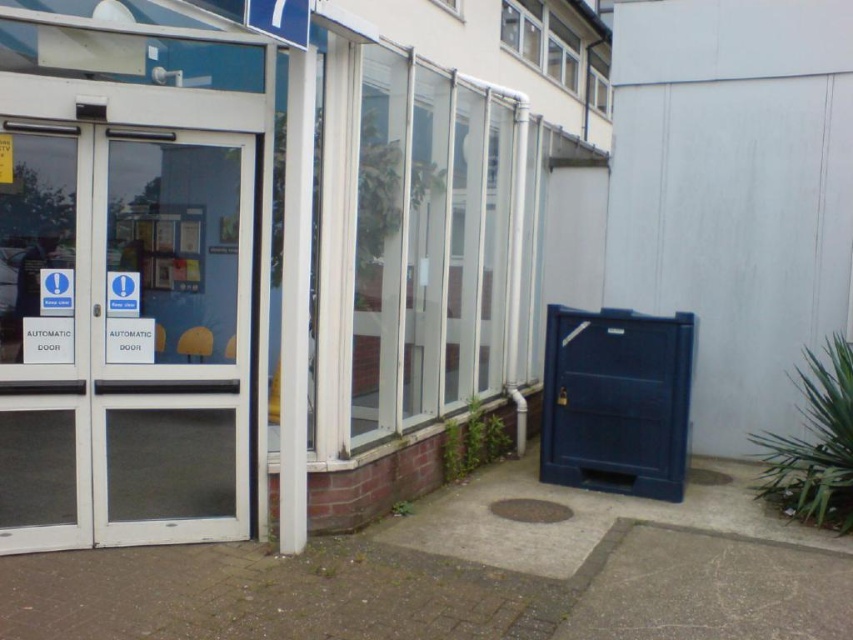
Which of these two, transparent glass door at left or transparent glass door at center, stands taller?

With more height is transparent glass door at center.

Which is more to the left, transparent glass door at left or transparent glass door at center?

transparent glass door at left

Which is behind, point (73, 534) or point (451, 381)?

The point (451, 381) is behind.

Where is `transparent glass door at left`? This screenshot has width=853, height=640. transparent glass door at left is located at coordinates (123, 336).